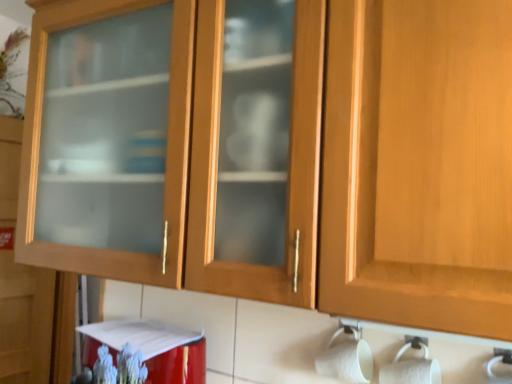
Question: Is white matte toilet paper at lower right outside of red glossy appliance at lower left?

Choices:
 (A) no
 (B) yes

Answer: (B)

Question: Considering the relative sizes of white matte toilet paper at lower right and red glossy appliance at lower left in the image provided, is white matte toilet paper at lower right smaller than red glossy appliance at lower left?

Choices:
 (A) yes
 (B) no

Answer: (A)

Question: Is white matte toilet paper at lower right aimed at red glossy appliance at lower left?

Choices:
 (A) no
 (B) yes

Answer: (A)

Question: Is white matte toilet paper at lower right wider than red glossy appliance at lower left?

Choices:
 (A) yes
 (B) no

Answer: (B)

Question: Can you confirm if white matte toilet paper at lower right is thinner than red glossy appliance at lower left?

Choices:
 (A) yes
 (B) no

Answer: (A)

Question: Considering the relative positions of white matte toilet paper at lower right and red glossy appliance at lower left in the image provided, is white matte toilet paper at lower right to the left of red glossy appliance at lower left from the viewer's perspective?

Choices:
 (A) yes
 (B) no

Answer: (B)

Question: Are red glossy appliance at lower left and white matte toilet paper at lower right making contact?

Choices:
 (A) no
 (B) yes

Answer: (A)

Question: Does red glossy appliance at lower left appear on the right side of white matte toilet paper at lower right?

Choices:
 (A) yes
 (B) no

Answer: (B)

Question: Does red glossy appliance at lower left have a larger size compared to white matte toilet paper at lower right?

Choices:
 (A) no
 (B) yes

Answer: (B)

Question: Would you say white matte toilet paper at lower right is part of red glossy appliance at lower left's contents?

Choices:
 (A) yes
 (B) no

Answer: (B)

Question: Does red glossy appliance at lower left have a smaller size compared to white matte toilet paper at lower right?

Choices:
 (A) no
 (B) yes

Answer: (A)

Question: Can you confirm if red glossy appliance at lower left is wider than white matte toilet paper at lower right?

Choices:
 (A) yes
 (B) no

Answer: (A)

Question: Can you confirm if red glossy appliance at lower left is thinner than matte glass cabinet at left?

Choices:
 (A) yes
 (B) no

Answer: (B)